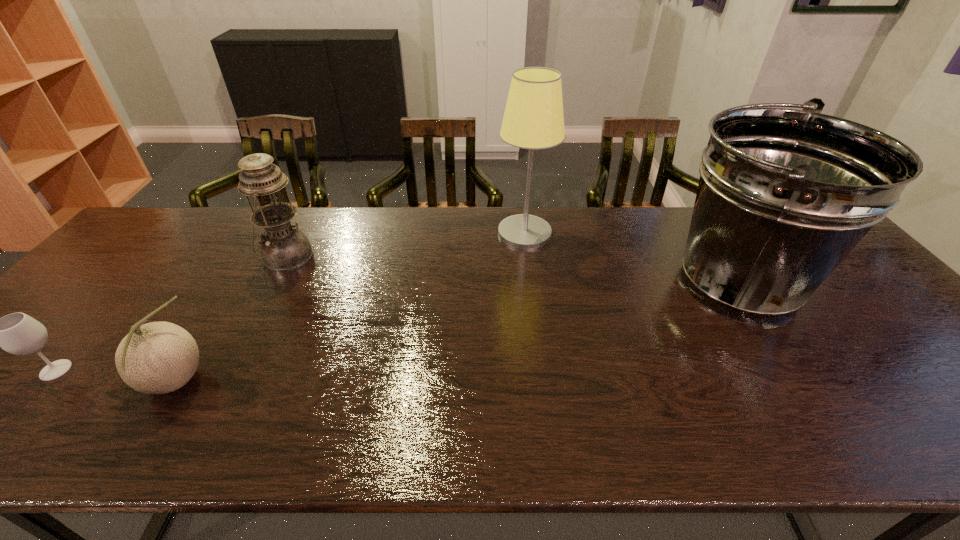
The width and height of the screenshot is (960, 540). I want to click on the fourth object from left to right, so click(x=533, y=119).

I want to click on bucket, so click(784, 195).

Locate an element on the screen. This screenshot has height=540, width=960. the third tallest object is located at coordinates (284, 248).

At what (x,y) coordinates should I click in order to perform the action: click on cantaloup. Please return your answer as a coordinate pair (x, y). This screenshot has width=960, height=540. Looking at the image, I should click on (158, 357).

Image resolution: width=960 pixels, height=540 pixels. In order to click on the shortest object in this screenshot , I will do `click(17, 333)`.

The image size is (960, 540). I want to click on the leftmost object, so click(x=17, y=333).

You are a GUI agent. You are given a task and a screenshot of the screen. Output one action in this format:
    pyautogui.click(x=<x>, y=<y>)
    Task: Click on the vacant space located 0.270m on the left of the table lamp
    The width and height of the screenshot is (960, 540).
    Given the screenshot: What is the action you would take?
    point(411,233)

This screenshot has width=960, height=540. I want to click on free space located on the right of the rightmost object, so pyautogui.click(x=845, y=284).

This screenshot has width=960, height=540. Find the location of `vacant area situated 0.360m on the front of the oil lamp`. vacant area situated 0.360m on the front of the oil lamp is located at coordinates (224, 378).

The width and height of the screenshot is (960, 540). I want to click on vacant space located 0.320m on the back of the fourth tallest object, so click(x=246, y=267).